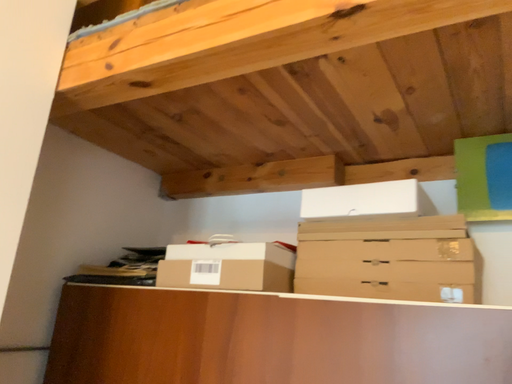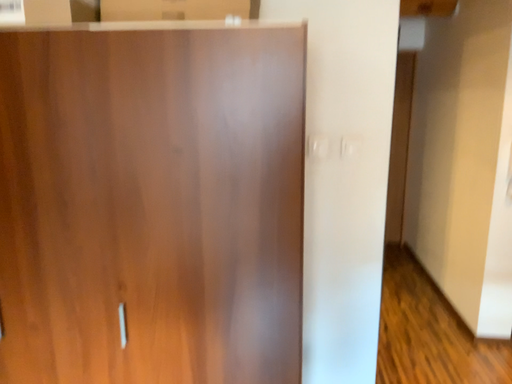
Question: How did the camera likely rotate when shooting the video?

Choices:
 (A) rotated right
 (B) rotated left

Answer: (A)